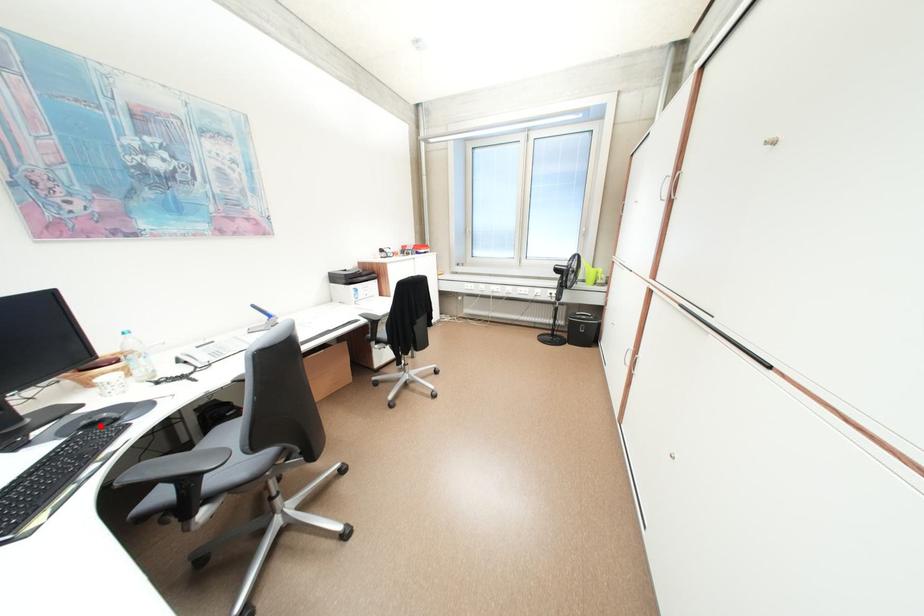
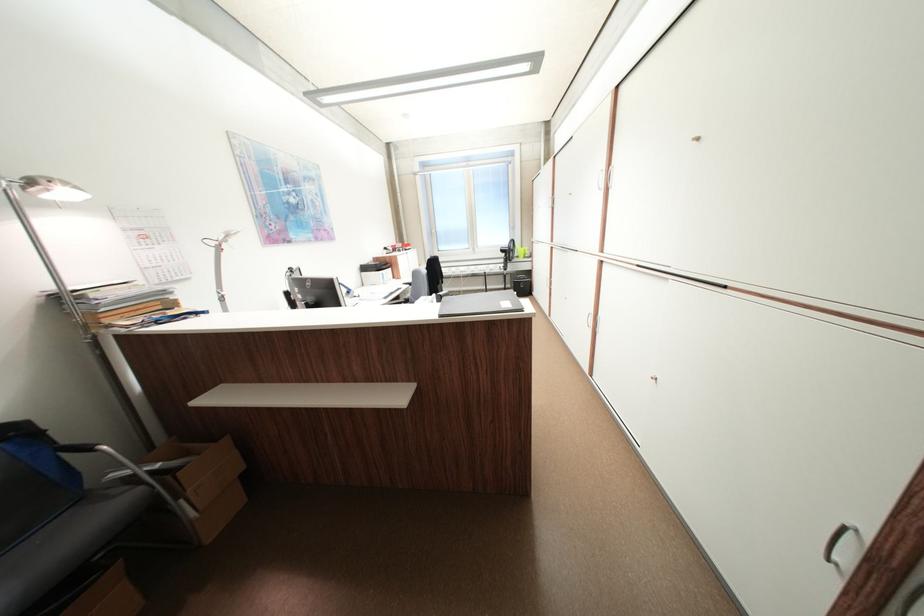
Question: I am providing you with two images of the same scene from different viewpoints. A red point is marked on the first image. At the location where the point appears in image 1, is it still visible in image 2?

Choices:
 (A) Yes
 (B) No

Answer: (B)